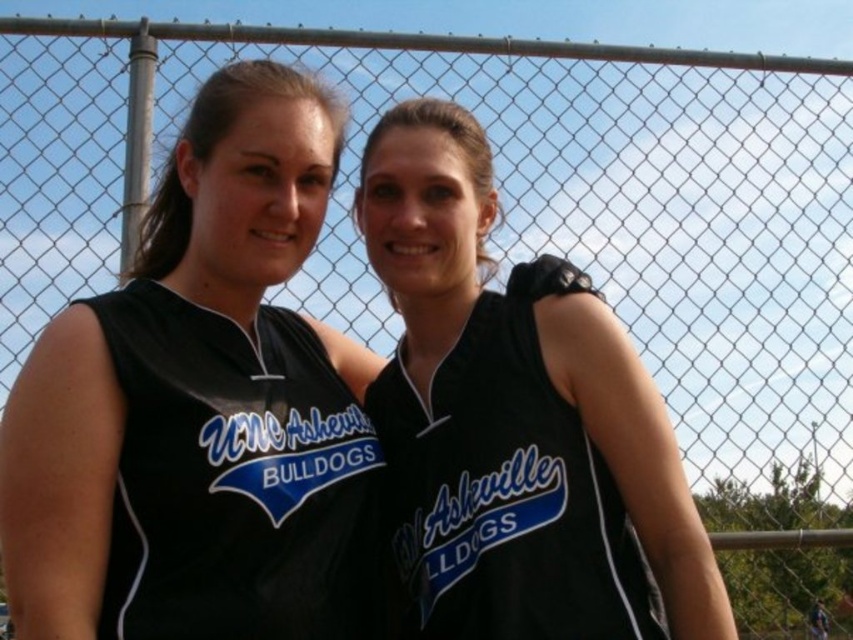
Is point (122, 625) positioned before point (447, 371)?

Yes, point (122, 625) is in front of point (447, 371).

How much distance is there between black jersey at left and black jersey at center?

The distance of black jersey at left from black jersey at center is 3.97 meters.

Where is `black jersey at left`? black jersey at left is located at coordinates (235, 477).

Where is `black jersey at left`? black jersey at left is located at coordinates (235, 477).